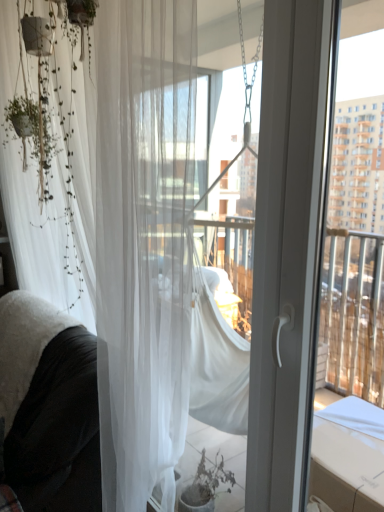
In order to face velvet dark brown rocking chair at left, should I rotate leftwards or rightwards?

Turn left approximately 23.244 degrees to face it.

This screenshot has width=384, height=512. What do you see at coordinates (48, 407) in the screenshot?
I see `velvet dark brown rocking chair at left` at bounding box center [48, 407].

The image size is (384, 512). What are the coordinates of `velvet dark brown rocking chair at left` in the screenshot? It's located at (48, 407).

The image size is (384, 512). I want to click on velvet dark brown rocking chair at left, so [48, 407].